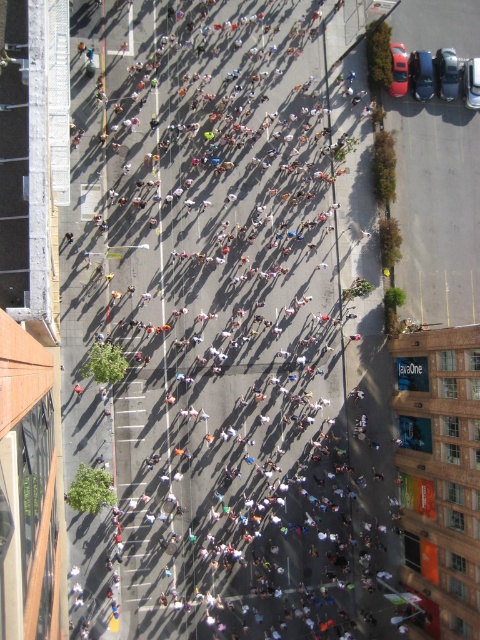
Does point (420, 56) lie in front of point (391, 49)?

No, it is behind (391, 49).

Locate an element on the screen. The image size is (480, 640). shiny black sedan at upper right is located at coordinates (420, 74).